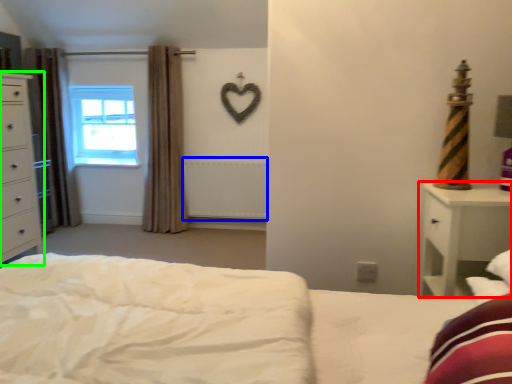
Question: Which is farther away from nightstand (highlighted by a red box)? radiator (highlighted by a blue box) or chest of drawers (highlighted by a green box)?

Choices:
 (A) radiator
 (B) chest of drawers

Answer: (B)